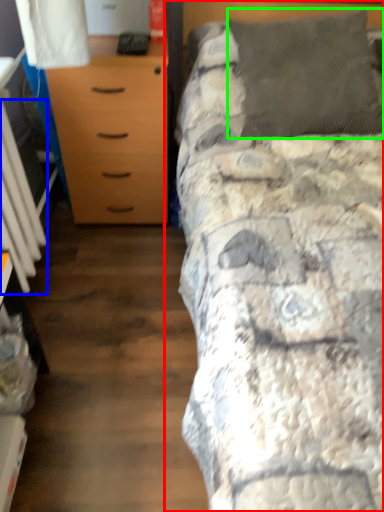
Question: Estimate the real-world distances between objects in this image. Which object is farther from bed (highlighted by a red box), radiator (highlighted by a blue box) or pillow (highlighted by a green box)?

Choices:
 (A) radiator
 (B) pillow

Answer: (A)